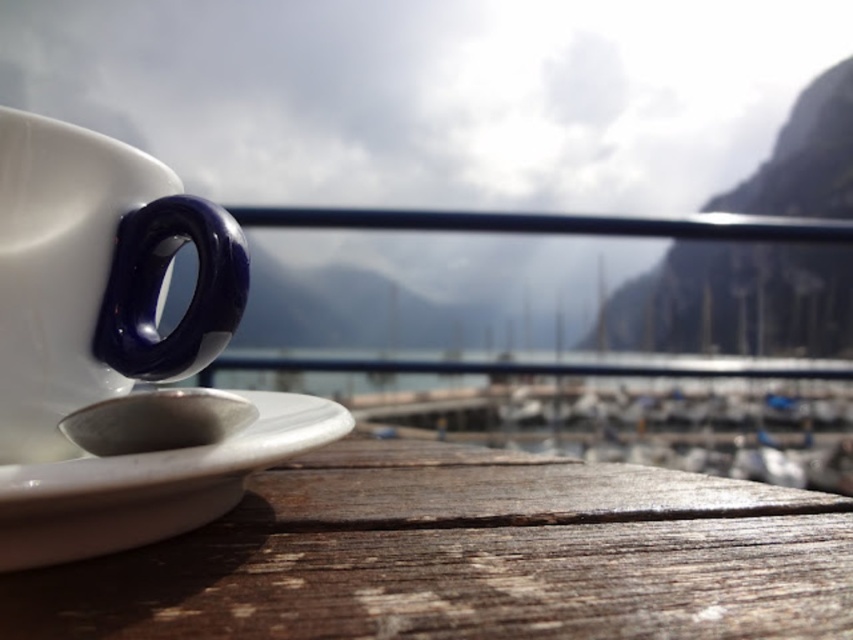
Which is behind, point (207, 627) or point (160, 346)?

Point (160, 346)

Is wooden table at lower left positioned at the back of white glossy mug at left?

No.

Is point (141, 552) farther from camera compared to point (141, 372)?

No, (141, 552) is in front of (141, 372).

In order to click on wooden table at lower left in this screenshot , I will do `click(466, 556)`.

Does white glossy mug at left have a smaller size compared to white glossy saucer at lower left?

Correct, white glossy mug at left occupies less space than white glossy saucer at lower left.

Between point (22, 234) and point (146, 529), which one is positioned behind?

Positioned behind is point (22, 234).

This screenshot has width=853, height=640. In order to click on white glossy mug at left in this screenshot , I will do `click(96, 276)`.

Find the location of a particular element. The image size is (853, 640). white glossy mug at left is located at coordinates (96, 276).

Is wooden table at lower left positioned before white glossy saucer at lower left?

Yes.

Is wooden table at lower left further to the viewer compared to white glossy saucer at lower left?

That is False.

Does point (473, 548) lie in front of point (209, 497)?

That is True.

Find the location of a particular element. This screenshot has height=640, width=853. wooden table at lower left is located at coordinates (466, 556).